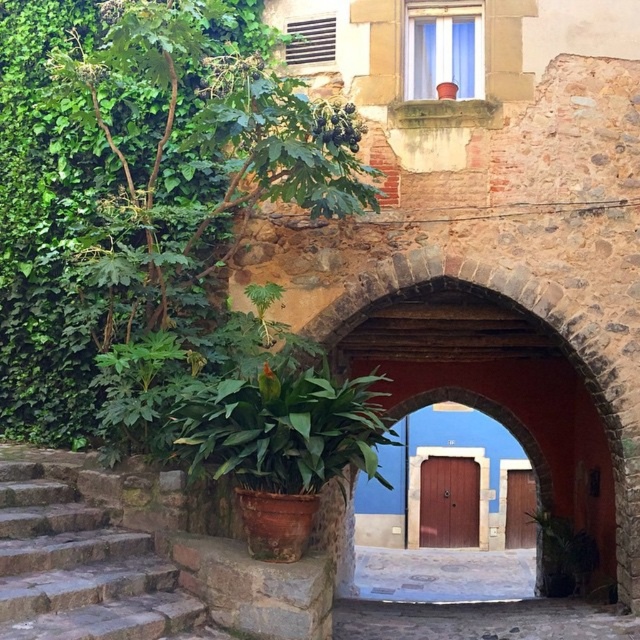
Is green matte plant at center to the left of wooden door at center from the viewer's perspective?

Yes, green matte plant at center is to the left of wooden door at center.

Is green matte plant at center thinner than wooden door at center?

In fact, green matte plant at center might be wider than wooden door at center.

This screenshot has width=640, height=640. What do you see at coordinates (284, 428) in the screenshot? I see `green matte plant at center` at bounding box center [284, 428].

Identify the location of green matte plant at center. (284, 428).

Based on the photo, who is higher up, brown stone stairs at lower left or wooden door at center?

brown stone stairs at lower left is above.

Between brown stone stairs at lower left and wooden door at center, which one is positioned lower?

Positioned lower is wooden door at center.

Find the location of a particular element. This screenshot has width=640, height=640. brown stone stairs at lower left is located at coordinates (83, 570).

In the scene shown: Between brown stone stairs at lower left and brown wooden door at center, which one has more height?

brown wooden door at center

Where is `brown stone stairs at lower left`? brown stone stairs at lower left is located at coordinates (83, 570).